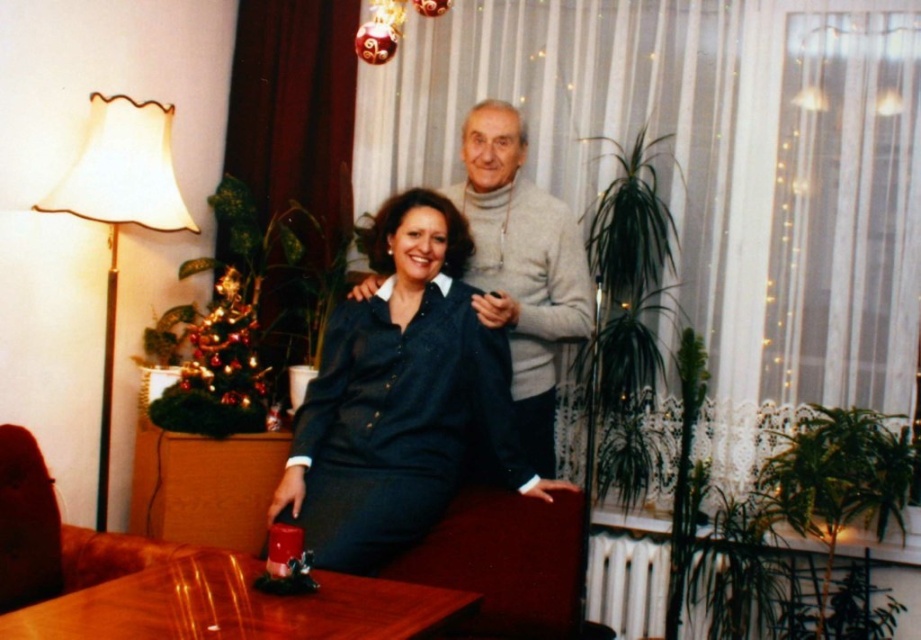
Question: Is light gray turtleneck sweater at center to the right of brown leather armchair at lower left from the viewer's perspective?

Choices:
 (A) yes
 (B) no

Answer: (A)

Question: Which point is farther to the camera?

Choices:
 (A) (203, 342)
 (B) (430, 390)

Answer: (A)

Question: Among these points, which one is farthest from the camera?

Choices:
 (A) (114, 538)
 (B) (164, 168)
 (C) (175, 404)

Answer: (C)

Question: Is denim shirt at center to the right of light gray turtleneck sweater at center from the viewer's perspective?

Choices:
 (A) yes
 (B) no

Answer: (B)

Question: Does light gray turtleneck sweater at center come in front of brown leather armchair at lower left?

Choices:
 (A) yes
 (B) no

Answer: (B)

Question: Which object is closer to the camera taking this photo?

Choices:
 (A) brown leather armchair at lower left
 (B) shiny metallic christmas tree at left
 (C) glossy wood table at lower center

Answer: (C)